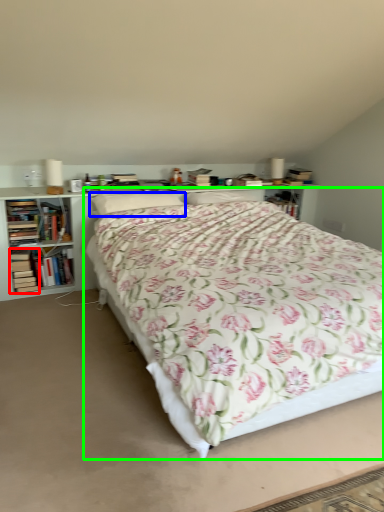
Question: Which object is the closest to the book (highlighted by a red box)? Choose among these: pillow (highlighted by a blue box) or bed (highlighted by a green box).

Choices:
 (A) pillow
 (B) bed

Answer: (A)